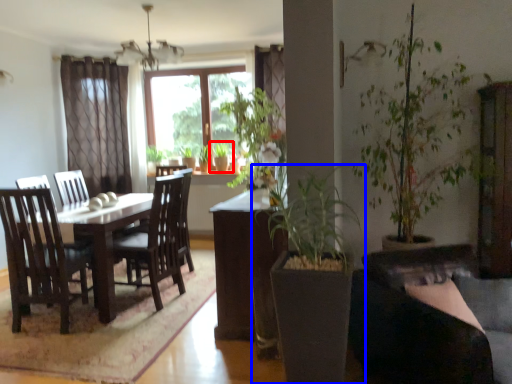
Question: Which point is closer to the camera, houseplant (highlighted by a red box) or houseplant (highlighted by a blue box)?

Choices:
 (A) houseplant
 (B) houseplant

Answer: (B)